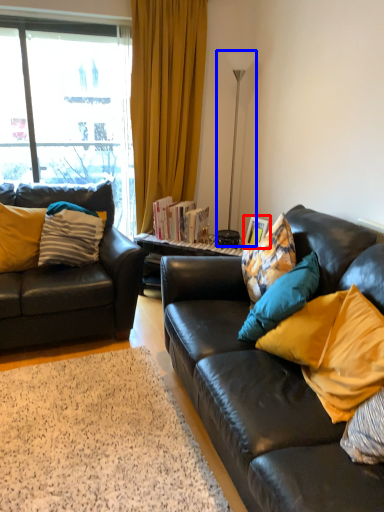
Question: Which point is closer to the camera, picture frame (highlighted by a red box) or lamp (highlighted by a blue box)?

Choices:
 (A) picture frame
 (B) lamp

Answer: (B)